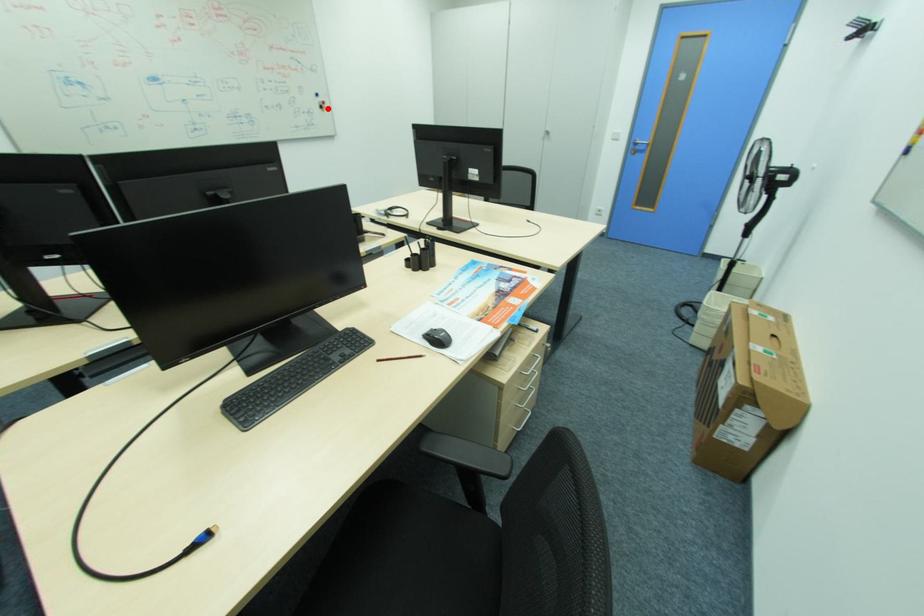
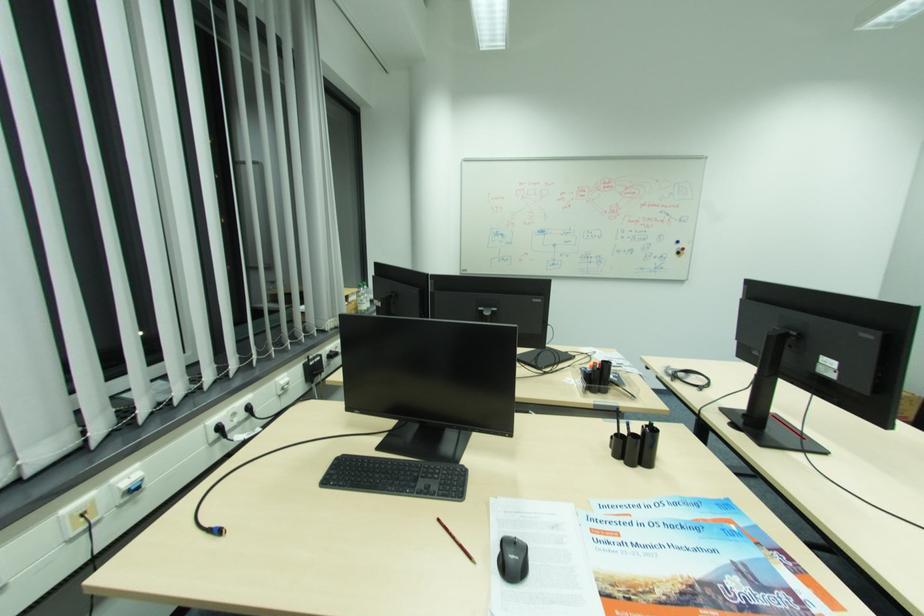
Where in the second image is the point corresponding to the highlighted location from the first image?

(684, 253)